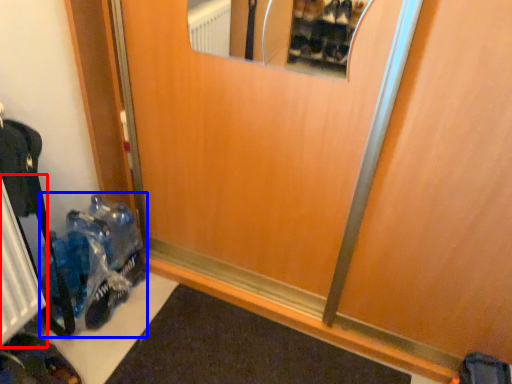
Question: Among these objects, which one is farthest to the camera, radiator (highlighted by a red box) or toy (highlighted by a blue box)?

Choices:
 (A) radiator
 (B) toy

Answer: (B)